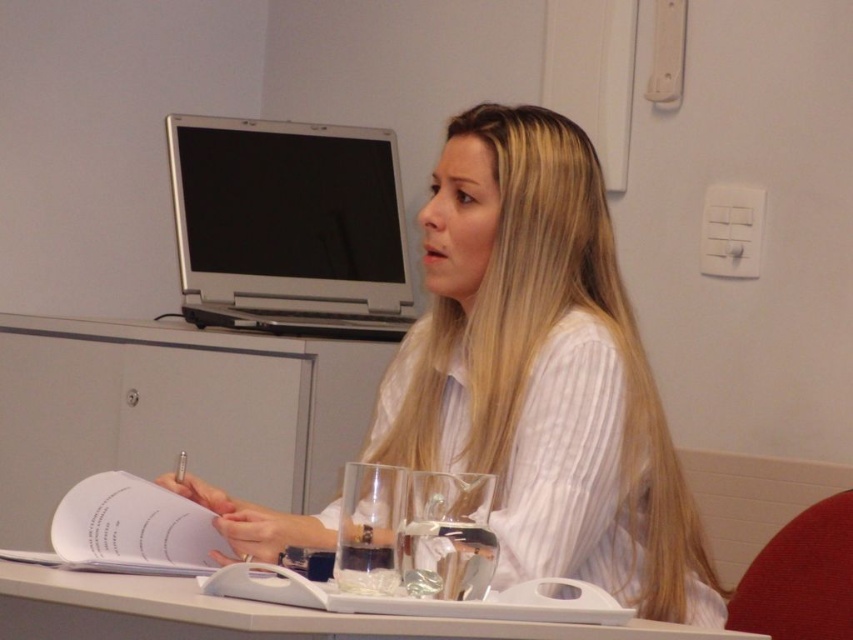
You are organizing a meeting and need to place a name tag on the table. The name tag is larger than the white plastic tray at center. Can you place the name tag on the white striped shirt at center?

The white striped shirt at center is bigger than the white plastic tray at center. Since the name tag is larger than the white plastic tray, it can fit on the white striped shirt at center as it is larger than the tray.

You are a waiter in a restaurant and need to deliver a drink to the person seated at the table. The drink must be placed within 12 inches of the clear glass wine glass at center. Can you place the drink on the table without it being too close to the white striped shirt at center?

The white striped shirt at center is 14.57 inches from the clear glass wine glass at center. Since the required distance for placing the drink is within 12 inches of the wine glass, placing it there would mean it is 14.57 inches away from the shirt, which is acceptable as it does not violate the 12 inch rule.